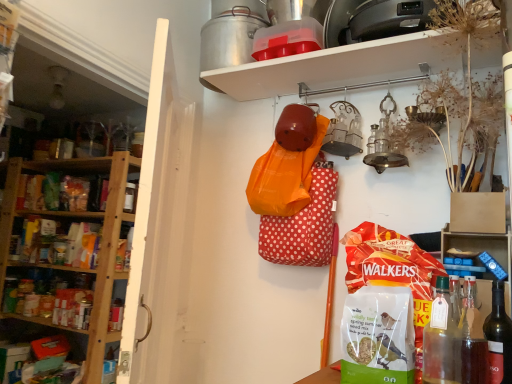
Question: Which is correct: translucent glass bottle at lower right, which is the 2th bottle from left to right, is inside blue plastic blocks at right, arranged as the first shelf when viewed from the right, or outside of it?

Choices:
 (A) inside
 (B) outside

Answer: (B)

Question: Does point (468, 377) appear closer or farther from the camera than point (506, 233)?

Choices:
 (A) farther
 (B) closer

Answer: (B)

Question: Which object is the closest to the blue plastic blocks at right, arranged as the first shelf when viewed from the right?

Choices:
 (A) metallic silver at upper center, marked as the 2th shelf in a left-to-right arrangement
 (B) dark red glass bottle at lower right, the 3th bottle positioned from the left
 (C) white plastic shelf at upper center, which is counted as the third shelf, starting from the right
 (D) translucent glass bottle at lower right, which is the 2th bottle from left to right
 (E) transparent glass bottle at lower right, which is counted as the 3th bottle, starting from the right

Answer: (B)

Question: Considering the real-world distances, which object is farthest from the translucent glass bottle at lower right, which is the 2th bottle from left to right?

Choices:
 (A) white plastic shelf at upper center, which is counted as the third shelf, starting from the right
 (B) blue plastic blocks at right, arranged as the first shelf when viewed from the right
 (C) metallic silver at upper center, the second shelf in the right-to-left sequence
 (D) transparent glass bottle at lower right, which is counted as the 3th bottle, starting from the right
 (E) dark red glass bottle at lower right, the 3th bottle positioned from the left

Answer: (A)